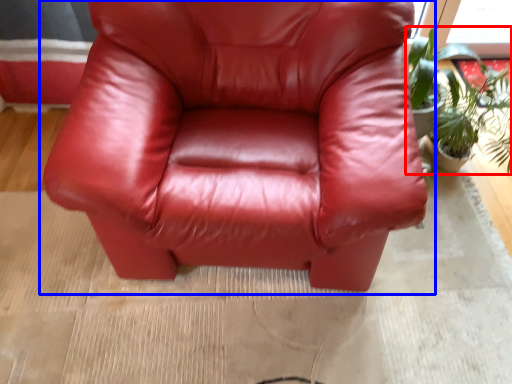
Question: Which object appears farthest to the camera in this image, houseplant (highlighted by a red box) or chair (highlighted by a blue box)?

Choices:
 (A) houseplant
 (B) chair

Answer: (A)